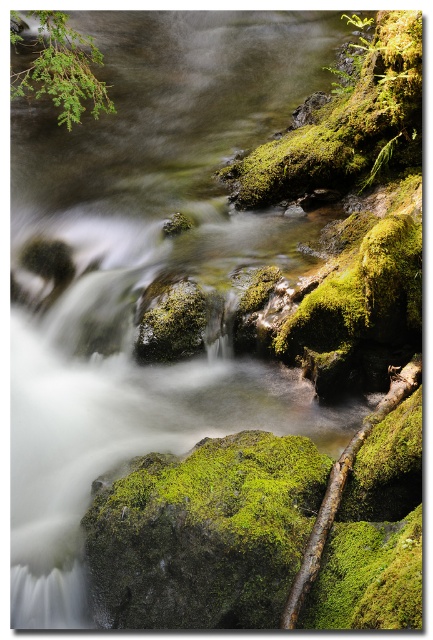
You are a photographer trying to capture the green mossy rock at upper right and the green leafy branch at upper left in the same frame. Based on their sizes, which object should you focus on first to ensure both are in focus?

The green mossy rock at upper right is taller than the green leafy branch at upper left, so focusing on the taller rock first would help ensure both are in focus.

You are a photographer planning to take a closeup shot of both the green mossy rock at upper right and the green leafy branch at upper left. Given that your camera lens has a maximum focus distance of 5 feet, will you be able to capture both objects in focus without moving the camera?

The green mossy rock at upper right and green leafy branch at upper left are 5.70 feet apart from each other. Since the maximum focus distance of the camera lens is 5 feet, the distance between them exceeds this limit. Therefore, you cannot capture both objects in focus without moving the camera.

You are standing at the edge of the stream in the image and want to place a small decorative rock on the green mossy rock at upper right. The coordinates given are for the exact spot where the moss is thickest. Can you confirm if the point marked by coordinates point (346, 124) is on the green mossy rock at upper right?

Yes, the point (346, 124) is on the green mossy rock at upper right as stated in the description.